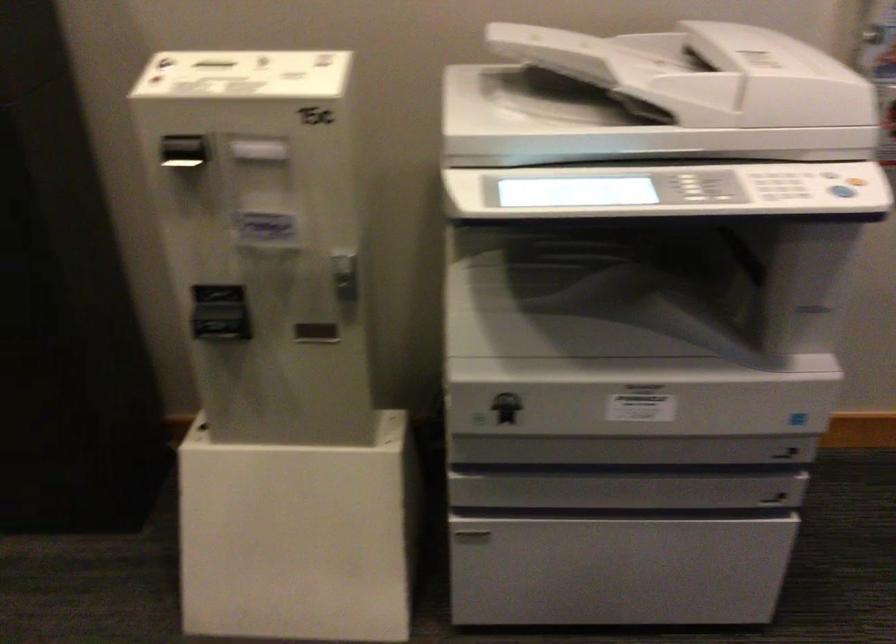
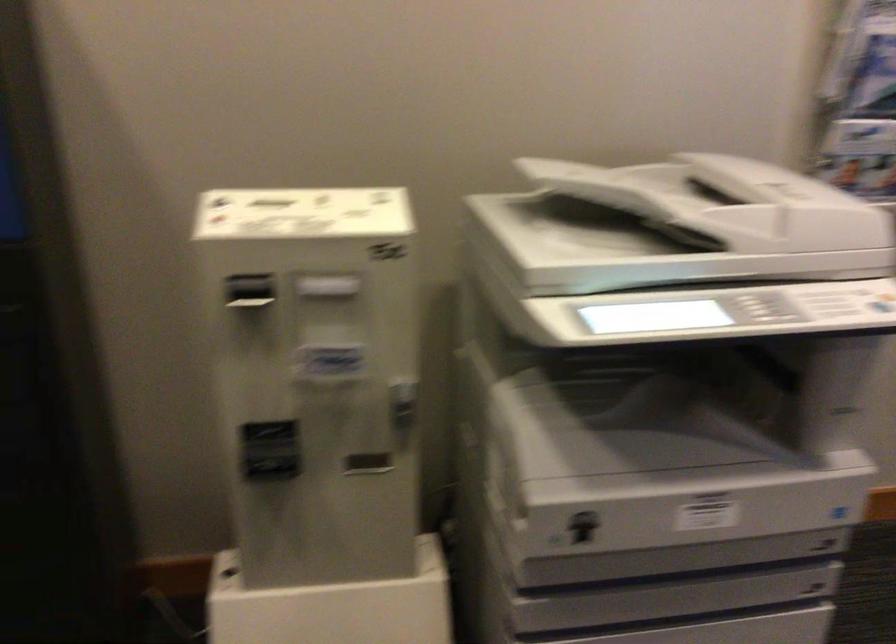
Find the pixel in the second image that matches point 716,77 in the first image.

(724, 203)